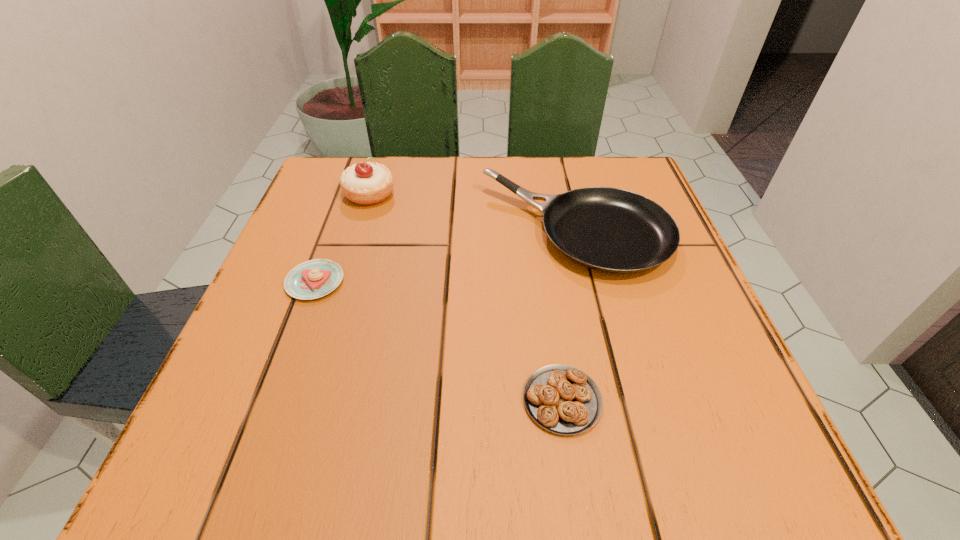
Where is `pastry that is at the far edge`? Image resolution: width=960 pixels, height=540 pixels. pastry that is at the far edge is located at coordinates (368, 183).

The width and height of the screenshot is (960, 540). In order to click on pan that is at the far edge in this screenshot , I will do `click(612, 230)`.

Locate an element on the screen. This screenshot has height=540, width=960. object located in the near edge section of the desktop is located at coordinates (562, 399).

The image size is (960, 540). Find the location of `object that is at the right edge`. object that is at the right edge is located at coordinates (612, 230).

Locate an element on the screen. Image resolution: width=960 pixels, height=540 pixels. object that is positioned at the far left corner is located at coordinates (368, 183).

Image resolution: width=960 pixels, height=540 pixels. I want to click on object that is at the far right corner, so click(612, 230).

The height and width of the screenshot is (540, 960). In the image, there is a desktop. Identify the location of vacant space at the far edge. (410, 208).

Where is `vacant space at the near edge of the desktop`? The height and width of the screenshot is (540, 960). vacant space at the near edge of the desktop is located at coordinates (372, 462).

What are the coordinates of `vacant space at the left edge` in the screenshot? It's located at (295, 377).

The height and width of the screenshot is (540, 960). Find the location of `free point at the far left corner`. free point at the far left corner is located at coordinates (312, 213).